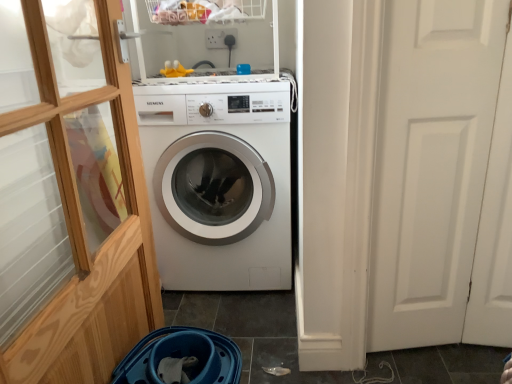
The width and height of the screenshot is (512, 384). I want to click on transparent wood glass door at left, so click(70, 197).

Find the location of a particular element. The width and height of the screenshot is (512, 384). white matte door at right is located at coordinates (431, 165).

Locate an element on the screen. This screenshot has width=512, height=384. transparent wood glass door at left is located at coordinates (70, 197).

Between white glossy washing machine at center and white matte door at right, which one appears on the left side from the viewer's perspective?

white glossy washing machine at center.

Considering the relative positions of white glossy washing machine at center and white matte door at right in the image provided, is white glossy washing machine at center in front of white matte door at right?

That is False.

From the image's perspective, is white glossy washing machine at center over white matte door at right?

Yes, from the image's perspective, white glossy washing machine at center is over white matte door at right.

There is a white glossy washing machine at center. Find the location of `screen door above it (from a real-world perspective)`. screen door above it (from a real-world perspective) is located at coordinates (431, 165).

Which of these two, white plastic shelf at upper center or transparent wood glass door at left, stands shorter?

white plastic shelf at upper center.

Is white plastic shelf at upper center with transparent wood glass door at left?

No.

Would you say white plastic shelf at upper center contains transparent wood glass door at left?

No, transparent wood glass door at left is not inside white plastic shelf at upper center.

Could you tell me if white matte door at right is facing white plastic shelf at upper center?

No, white matte door at right is not aimed at white plastic shelf at upper center.

From the image's perspective, which is below, white matte door at right or white plastic shelf at upper center?

white matte door at right.

Can you tell me how much white matte door at right and white plastic shelf at upper center differ in facing direction?

The angular difference between white matte door at right and white plastic shelf at upper center is 0.125 degrees.

Looking at this image, is white matte door at right outside of white plastic shelf at upper center?

Absolutely, white matte door at right is external to white plastic shelf at upper center.

Do you think white glossy washing machine at center is within transparent wood glass door at left, or outside of it?

white glossy washing machine at center is located beyond the bounds of transparent wood glass door at left.

From the image's perspective, which is above, white glossy washing machine at center or transparent wood glass door at left?

white glossy washing machine at center is shown above in the image.

Looking at their sizes, would you say white glossy washing machine at center is wider or thinner than transparent wood glass door at left?

In the image, white glossy washing machine at center appears to be wider than transparent wood glass door at left.

Is transparent wood glass door at left located outside white plastic shelf at upper center?

That's correct, transparent wood glass door at left is outside of white plastic shelf at upper center.

You are a GUI agent. You are given a task and a screenshot of the screen. Output one action in this format:
    pyautogui.click(x=<x>, y=<y>)
    Task: Click on the shelf above the transparent wood glass door at left (from a real-world perspective)
    This screenshot has height=384, width=512.
    Given the screenshot: What is the action you would take?
    pos(204,38)

From a real-world perspective, which is physically above, transparent wood glass door at left or white plastic shelf at upper center?

In real-world perspective, white plastic shelf at upper center is above.

Is transparent wood glass door at left not close to white plastic shelf at upper center?

transparent wood glass door at left is actually quite close to white plastic shelf at upper center.

How many degrees apart are the facing directions of white matte door at right and white glossy washing machine at center?

There is a 0.000646-degree angle between the facing directions of white matte door at right and white glossy washing machine at center.

Based on the photo, is white matte door at right to the right of white glossy washing machine at center from the viewer's perspective?

Correct, you'll find white matte door at right to the right of white glossy washing machine at center.

From a real-world perspective, which object rests below the other?

white glossy washing machine at center.

Are white matte door at right and white glossy washing machine at center beside each other?

white matte door at right and white glossy washing machine at center are not in contact.

Which of these two, white matte door at right or transparent wood glass door at left, stands taller?

transparent wood glass door at left is taller.

Between white matte door at right and transparent wood glass door at left, which one appears on the right side from the viewer's perspective?

Positioned to the right is white matte door at right.

What's the angular difference between white matte door at right and transparent wood glass door at left's facing directions?

The angle between the facing direction of white matte door at right and the facing direction of transparent wood glass door at left is 89 degrees.

Is white matte door at right positioned behind transparent wood glass door at left?

Yes, white matte door at right is further from the camera.

Where is `washing machine on the left of white matte door at right`? This screenshot has height=384, width=512. washing machine on the left of white matte door at right is located at coordinates (218, 183).

Locate an element on the screen. The image size is (512, 384). shelf positioned vertically above the transparent wood glass door at left (from a real-world perspective) is located at coordinates (204, 38).

Looking at the image, which one is located further to white matte door at right, white plastic shelf at upper center or white glossy washing machine at center?

white plastic shelf at upper center lies further to white matte door at right than the other object.

Estimate the real-world distances between objects in this image. Which object is closer to transparent wood glass door at left, white plastic shelf at upper center or white matte door at right?

Based on the image, white plastic shelf at upper center appears to be nearer to transparent wood glass door at left.

When comparing their distances from white plastic shelf at upper center, does white matte door at right or transparent wood glass door at left seem closer?

Based on the image, transparent wood glass door at left appears to be nearer to white plastic shelf at upper center.

From the image, which object appears to be farther from white matte door at right, white glossy washing machine at center or white plastic shelf at upper center?

white plastic shelf at upper center is further to white matte door at right.

Estimate the real-world distances between objects in this image. Which object is closer to white matte door at right, transparent wood glass door at left or white glossy washing machine at center?

white glossy washing machine at center is positioned closer to the anchor white matte door at right.

Estimate the real-world distances between objects in this image. Which object is closer to white glossy washing machine at center, transparent wood glass door at left or white matte door at right?

Based on the image, transparent wood glass door at left appears to be nearer to white glossy washing machine at center.

Estimate the real-world distances between objects in this image. Which object is closer to white matte door at right, white glossy washing machine at center or transparent wood glass door at left?

white glossy washing machine at center is closer to white matte door at right.

In the scene shown: Considering their positions, is white plastic shelf at upper center positioned further to white matte door at right than transparent wood glass door at left?

Among the two, white plastic shelf at upper center is located further to white matte door at right.

You are a GUI agent. You are given a task and a screenshot of the screen. Output one action in this format:
    pyautogui.click(x=<x>, y=<y>)
    Task: Click on the screen door between transparent wood glass door at left and white plastic shelf at upper center from front to back
    Image resolution: width=512 pixels, height=384 pixels.
    Given the screenshot: What is the action you would take?
    pyautogui.click(x=431, y=165)

This screenshot has height=384, width=512. Find the location of `shelf between transparent wood glass door at left and white glossy washing machine at center along the z-axis`. shelf between transparent wood glass door at left and white glossy washing machine at center along the z-axis is located at coordinates (204, 38).

Where is `washing machine between white plastic shelf at upper center and white matte door at right from left to right`? washing machine between white plastic shelf at upper center and white matte door at right from left to right is located at coordinates (218, 183).

The height and width of the screenshot is (384, 512). I want to click on screen door positioned between transparent wood glass door at left and white glossy washing machine at center from near to far, so click(431, 165).